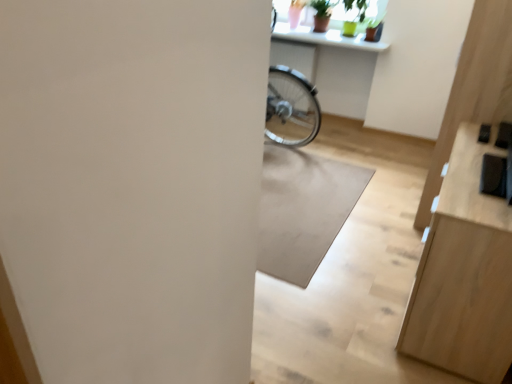
Question: Does white glossy counter top at upper center turn towards light wood dresser at right?

Choices:
 (A) no
 (B) yes

Answer: (A)

Question: Can you confirm if white glossy counter top at upper center is smaller than light wood dresser at right?

Choices:
 (A) yes
 (B) no

Answer: (A)

Question: Would you consider white glossy counter top at upper center to be distant from light wood dresser at right?

Choices:
 (A) yes
 (B) no

Answer: (A)

Question: Considering the relative sizes of white glossy counter top at upper center and light wood dresser at right in the image provided, is white glossy counter top at upper center shorter than light wood dresser at right?

Choices:
 (A) no
 (B) yes

Answer: (B)

Question: Is white glossy counter top at upper center in front of light wood dresser at right?

Choices:
 (A) yes
 (B) no

Answer: (B)

Question: Considering the positions of point (468, 253) and point (351, 182), is point (468, 253) closer or farther from the camera than point (351, 182)?

Choices:
 (A) farther
 (B) closer

Answer: (B)

Question: Is light wood dresser at right spatially inside white matte mat at center, or outside of it?

Choices:
 (A) outside
 (B) inside

Answer: (A)

Question: In terms of size, does light wood dresser at right appear bigger or smaller than white matte mat at center?

Choices:
 (A) small
 (B) big

Answer: (B)

Question: In the image, is light wood dresser at right positioned in front of or behind white matte mat at center?

Choices:
 (A) behind
 (B) front

Answer: (B)

Question: Is point (276, 230) positioned closer to the camera than point (465, 248)?

Choices:
 (A) closer
 (B) farther

Answer: (B)

Question: Based on their positions, is white matte mat at center located to the left or right of light wood dresser at right?

Choices:
 (A) left
 (B) right

Answer: (A)

Question: Considering the positions of white matte mat at center and light wood dresser at right in the image, is white matte mat at center wider or thinner than light wood dresser at right?

Choices:
 (A) thin
 (B) wide

Answer: (B)

Question: Is white matte mat at center bigger or smaller than light wood dresser at right?

Choices:
 (A) small
 (B) big

Answer: (A)

Question: From the image's perspective, is white glossy counter top at upper center above or below white matte mat at center?

Choices:
 (A) above
 (B) below

Answer: (A)

Question: Is point (359, 36) closer or farther from the camera than point (267, 264)?

Choices:
 (A) closer
 (B) farther

Answer: (B)